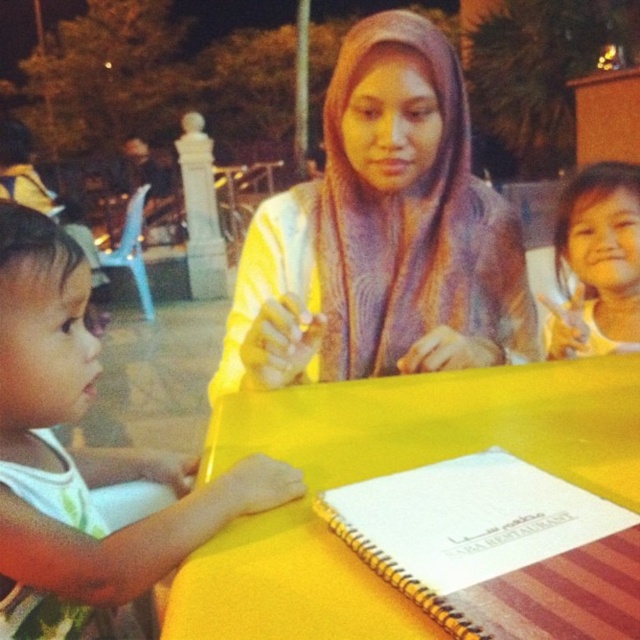
Can you confirm if white spiral notebook at center is positioned to the right of smooth white shirt at upper right?

Incorrect, white spiral notebook at center is not on the right side of smooth white shirt at upper right.

Does white spiral notebook at center lie in front of smooth white shirt at upper right?

Yes.

You are a GUI agent. You are given a task and a screenshot of the screen. Output one action in this format:
    pyautogui.click(x=<x>, y=<y>)
    Task: Click on the white spiral notebook at center
    This screenshot has height=640, width=640.
    Given the screenshot: What is the action you would take?
    pyautogui.click(x=497, y=548)

From the picture: Does yellow fabric table at center have a lesser width compared to purple knitted shawl at center?

No, yellow fabric table at center is not thinner than purple knitted shawl at center.

The width and height of the screenshot is (640, 640). What do you see at coordinates (381, 474) in the screenshot?
I see `yellow fabric table at center` at bounding box center [381, 474].

Between point (241, 541) and point (438, 83), which one is positioned behind?

The point (438, 83) is more distant.

Where is `yellow fabric table at center`? yellow fabric table at center is located at coordinates (381, 474).

Which is behind, point (515, 492) or point (385, 321)?

The point (385, 321) is more distant.

Who is taller, white spiral notebook at center or purple knitted shawl at center?

purple knitted shawl at center is taller.

Which is behind, point (420, 531) or point (342, 294)?

The point (342, 294) is more distant.

What are the coordinates of `white spiral notebook at center` in the screenshot? It's located at (497, 548).